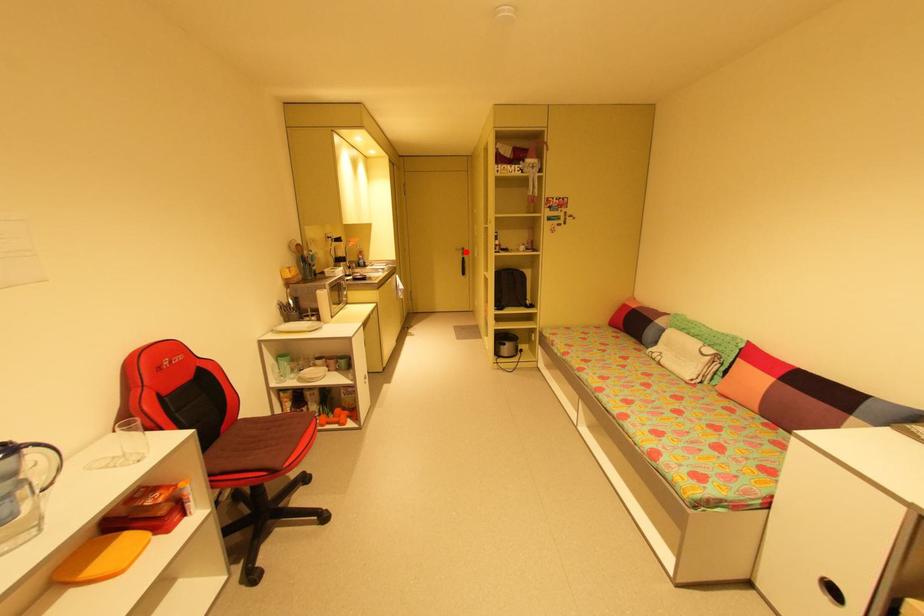
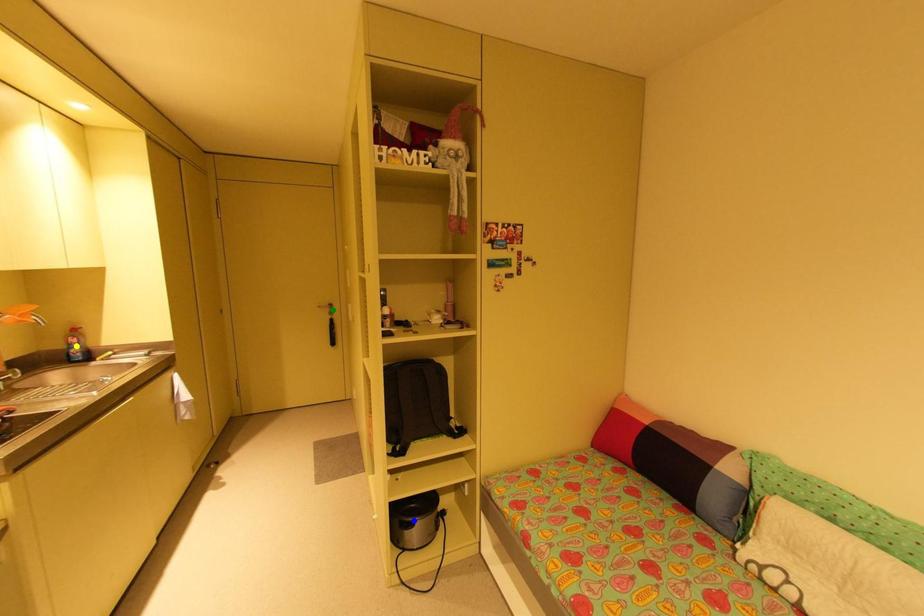
Question: I am providing you with two images of the same scene from different viewpoints. A red point is marked on the first image. You are given multiple points on the second image. Which point in image 2 is actually the same real-world point as the red point in image 1?

Choices:
 (A) green point
 (B) blue point
 (C) yellow point

Answer: (A)